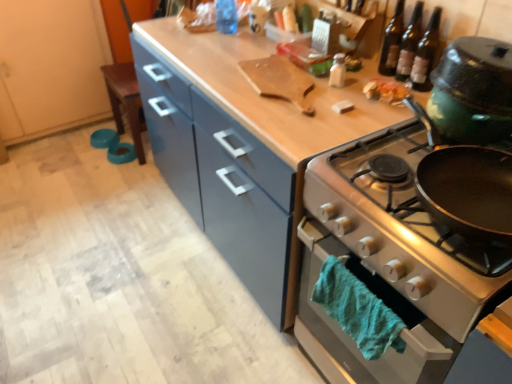
Identify the location of free location to the left of white matte salt shaker at center, positioned as the 1th bottle in bottom-to-top order. (284, 84).